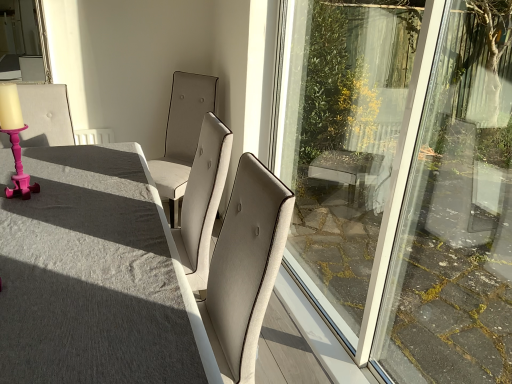
Question: Can you confirm if satin beige chair at center, which is the 2th chair in left-to-right order, is smaller than pink wood candle holder at left?

Choices:
 (A) no
 (B) yes

Answer: (A)

Question: Does satin beige chair at center, which is the 2th chair in left-to-right order, turn towards pink wood candle holder at left?

Choices:
 (A) no
 (B) yes

Answer: (B)

Question: Are satin beige chair at center, which is the 2th chair in left-to-right order, and pink wood candle holder at left beside each other?

Choices:
 (A) yes
 (B) no

Answer: (B)

Question: Can you confirm if satin beige chair at center, which is the 1th chair in right-to-left order, is positioned to the left of pink wood candle holder at left?

Choices:
 (A) yes
 (B) no

Answer: (B)

Question: From a real-world perspective, is satin beige chair at center, which is the 1th chair in right-to-left order, positioned under pink wood candle holder at left based on gravity?

Choices:
 (A) no
 (B) yes

Answer: (B)

Question: From a real-world perspective, is satin beige chair at center, which is the 2th chair in left-to-right order, on top of pink wood candle holder at left?

Choices:
 (A) yes
 (B) no

Answer: (B)

Question: Does matte gray table at center come in front of pink plastic candlestick at left, the second chair when ordered from right to left?

Choices:
 (A) yes
 (B) no

Answer: (A)

Question: Is matte gray table at center further to camera compared to pink plastic candlestick at left, placed as the first chair when sorted from left to right?

Choices:
 (A) yes
 (B) no

Answer: (B)

Question: Considering the relative sizes of matte gray table at center and pink plastic candlestick at left, the second chair when ordered from right to left, in the image provided, is matte gray table at center smaller than pink plastic candlestick at left, the second chair when ordered from right to left,?

Choices:
 (A) yes
 (B) no

Answer: (B)

Question: Is matte gray table at center taller than pink plastic candlestick at left, placed as the first chair when sorted from left to right?

Choices:
 (A) no
 (B) yes

Answer: (B)

Question: Can you confirm if matte gray table at center is bigger than pink plastic candlestick at left, placed as the first chair when sorted from left to right?

Choices:
 (A) yes
 (B) no

Answer: (A)

Question: Can you confirm if matte gray table at center is wider than pink plastic candlestick at left, the second chair when ordered from right to left?

Choices:
 (A) no
 (B) yes

Answer: (B)

Question: Does pink wood candle holder at left appear on the left side of pink plastic candlestick at left, the second chair when ordered from right to left?

Choices:
 (A) no
 (B) yes

Answer: (A)